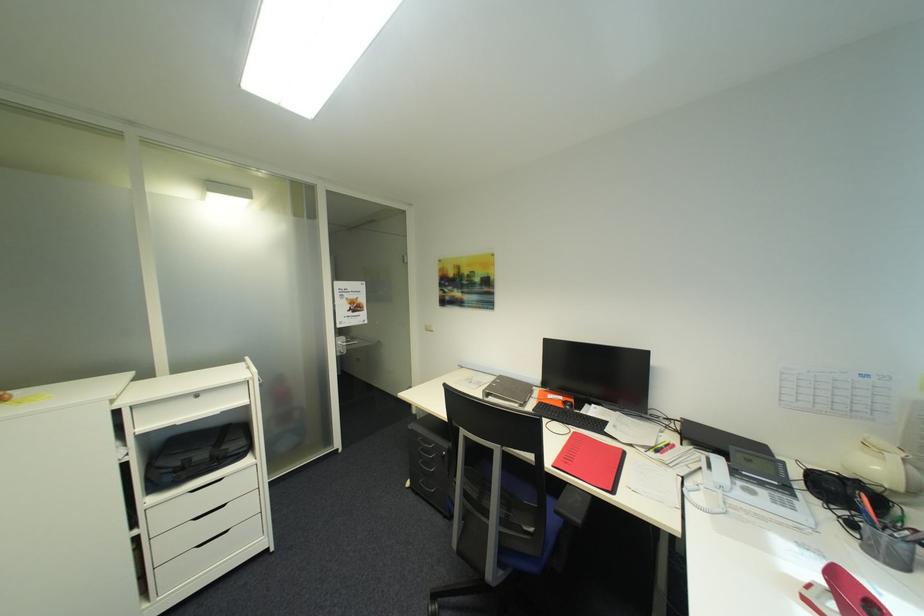
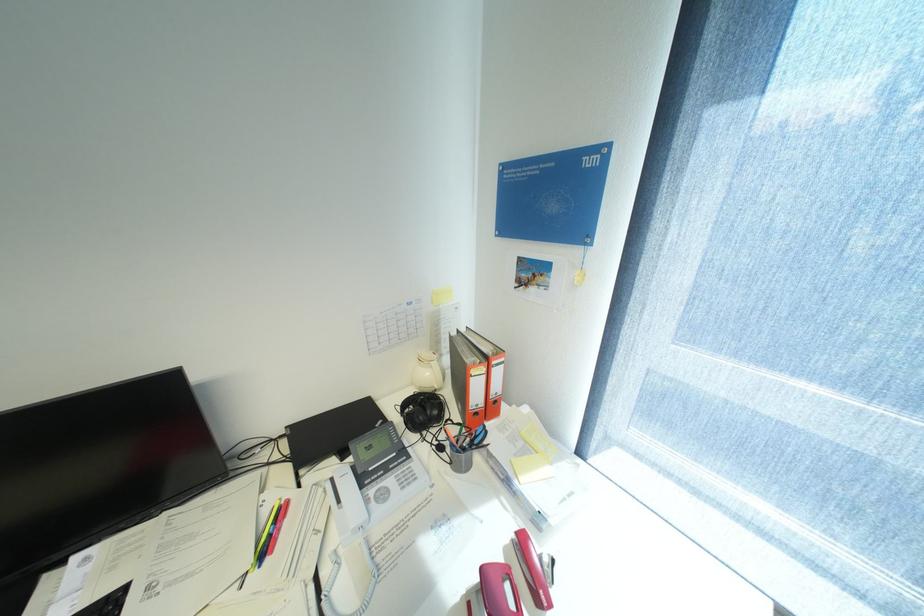
The first image is from the beginning of the video and the second image is from the end. How did the camera likely rotate when shooting the video?

The camera rotated toward right-down.